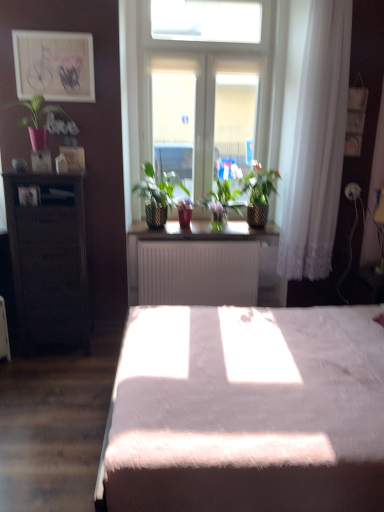
Question: From a real-world perspective, is matte wooden picture frame at upper left physically located above or below matte pink pot at upper left, positioned as the fourth houseplant in right-to-left order?

Choices:
 (A) below
 (B) above

Answer: (B)

Question: Is point (86, 93) positioned closer to the camera than point (33, 134)?

Choices:
 (A) farther
 (B) closer

Answer: (A)

Question: Estimate the real-world distances between objects in this image. Which object is farther from the white fluffy bed at center?

Choices:
 (A) white lace curtain at right
 (B) matte wooden picture frame at upper left
 (C) matte pink pot at upper left, positioned as the fourth houseplant in right-to-left order
 (D) green woven basket at center, which is the third houseplant in right-to-left order
 (E) green textured plant at center, which appears as the 1th houseplant when viewed from the right

Answer: (B)

Question: Which of these objects is positioned farthest from the green matte plant at center, which is counted as the 3th houseplant, starting from the left?

Choices:
 (A) matte pink pot at upper left, the first houseplant positioned from the left
 (B) green woven basket at center, which ranks as the second houseplant in left-to-right order
 (C) green textured plant at center, which appears as the 1th houseplant when viewed from the right
 (D) white matte radiator at center, the second table positioned from the left
 (E) white glass window at center

Answer: (A)